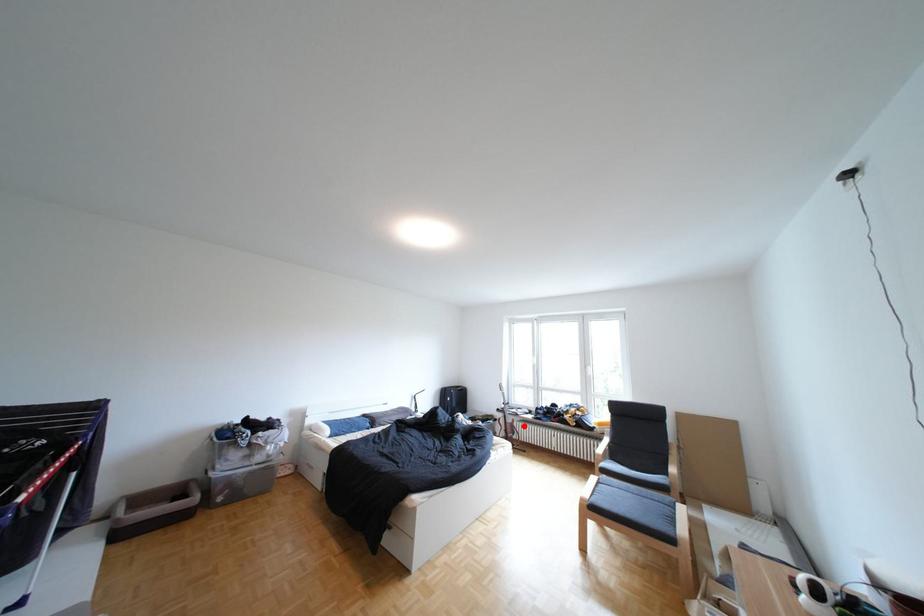
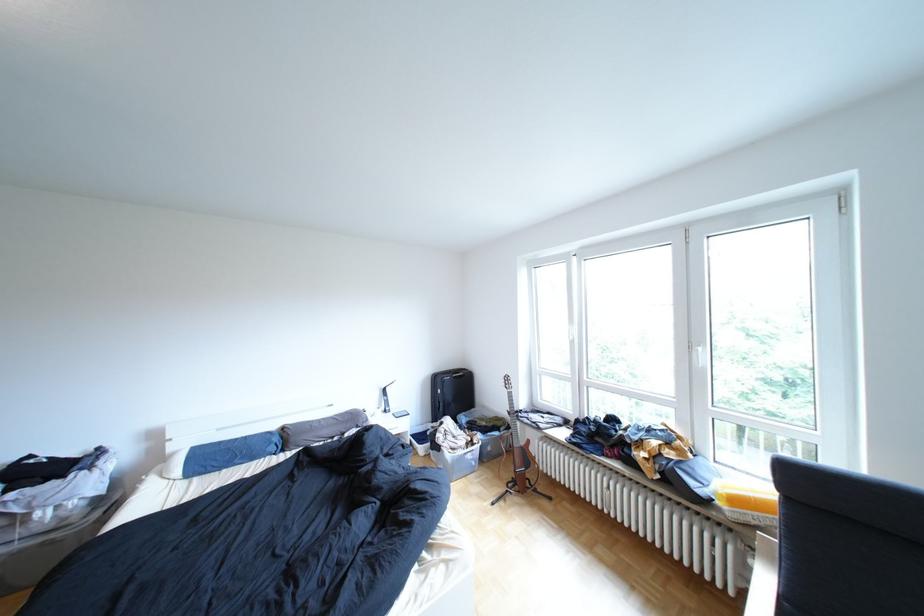
Locate, in the second image, the point that corresponds to the highlighted location in the first image.

(532, 453)